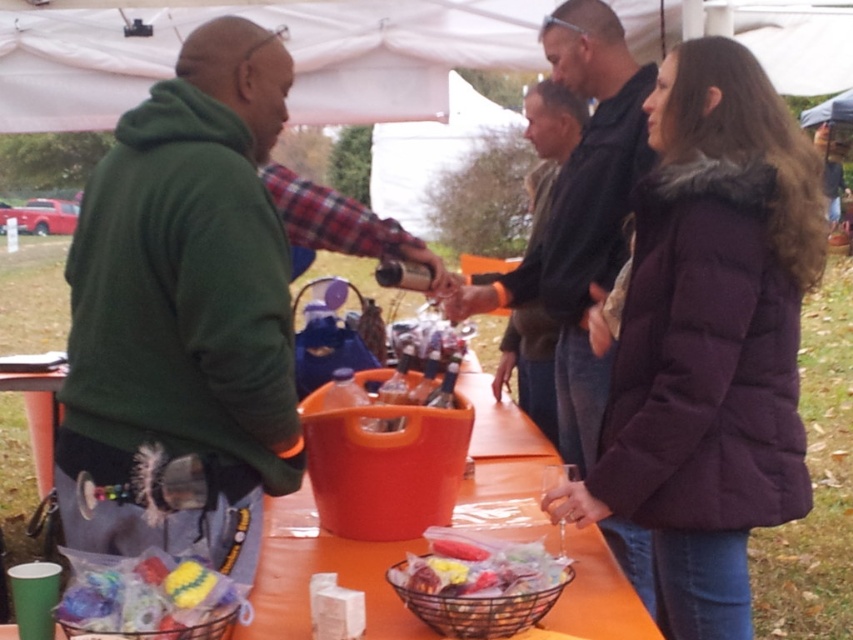
Question: Which object appears farthest from the camera in this image?

Choices:
 (A) green fleece jacket at left
 (B) dark brown leather jacket at center

Answer: (B)

Question: Which object is positioned farthest from the dark brown leather jacket at center?

Choices:
 (A) metallic wire basket at lower center
 (B) brightly colored sponges at lower left

Answer: (B)

Question: Is green fleece jacket at left bigger than dark gray sweater at center?

Choices:
 (A) no
 (B) yes

Answer: (B)

Question: Considering the relative positions of purple puffy coat at center and brightly colored sponges at lower left in the image provided, where is purple puffy coat at center located with respect to brightly colored sponges at lower left?

Choices:
 (A) below
 (B) above

Answer: (B)

Question: Estimate the real-world distances between objects in this image. Which object is closer to the metallic wire basket at lower center?

Choices:
 (A) dark brown leather jacket at center
 (B) green fleece jacket at left
 (C) dark gray sweater at center
 (D) brightly colored sponges at lower left

Answer: (D)

Question: Is purple puffy coat at center positioned before brightly colored sponges at lower left?

Choices:
 (A) no
 (B) yes

Answer: (A)